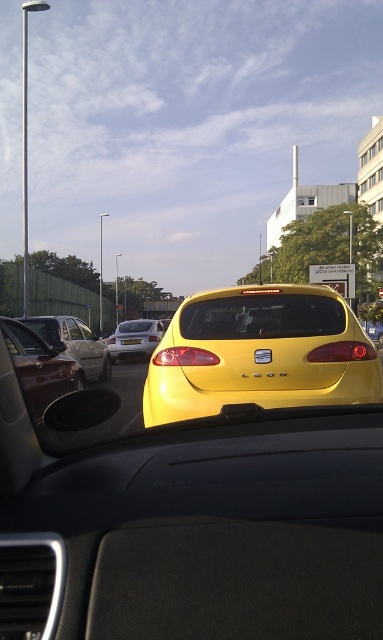
Does matte black sedan at left have a lesser width compared to yellow matte license plate at center?

In fact, matte black sedan at left might be wider than yellow matte license plate at center.

In the scene shown: Can you confirm if matte black sedan at left is bigger than yellow matte license plate at center?

Yes, matte black sedan at left is bigger than yellow matte license plate at center.

What do you see at coordinates (73, 342) in the screenshot? The height and width of the screenshot is (640, 383). I see `matte black sedan at left` at bounding box center [73, 342].

The height and width of the screenshot is (640, 383). In order to click on matte black sedan at left in this screenshot , I will do `click(73, 342)`.

Does shiny metallic car at left have a larger size compared to matte black sedan at left?

Incorrect, shiny metallic car at left is not larger than matte black sedan at left.

Can you confirm if shiny metallic car at left is thinner than matte black sedan at left?

Yes, shiny metallic car at left is thinner than matte black sedan at left.

Identify the location of shiny metallic car at left. Image resolution: width=383 pixels, height=640 pixels. (39, 368).

Where is `shiny metallic car at left`? This screenshot has height=640, width=383. shiny metallic car at left is located at coordinates (39, 368).

Locate an element on the screen. The image size is (383, 640). yellow matte hatchback at center is located at coordinates (260, 353).

Is point (289, 401) positioned in front of point (78, 332)?

That is True.

Where is `yellow matte hatchback at center`? yellow matte hatchback at center is located at coordinates (260, 353).